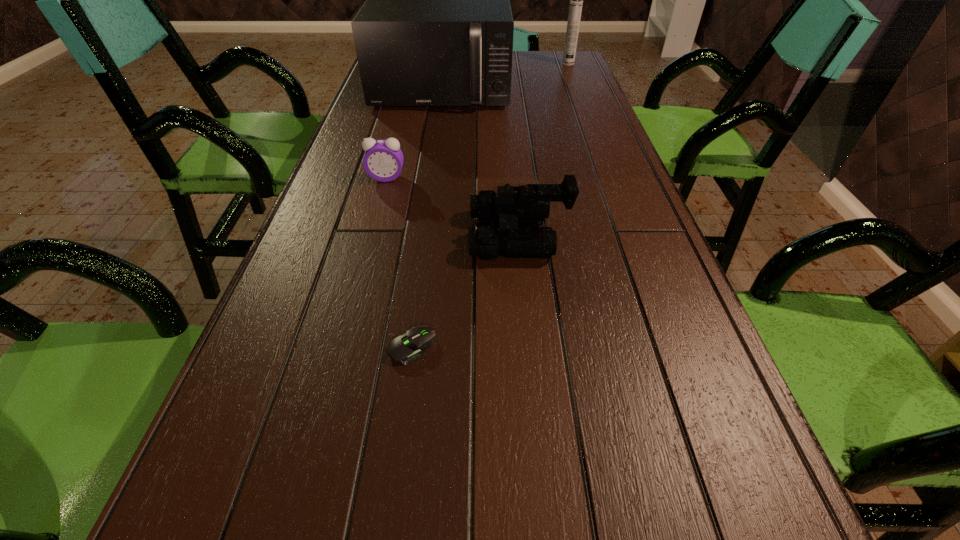
Where is `vacant region between the nearest object and the microwave oven`? vacant region between the nearest object and the microwave oven is located at coordinates (427, 218).

I want to click on vacant space that's between the aerosol can and the alarm clock, so click(x=477, y=121).

Where is `empty space that is in between the microwave oven and the nearest object`? This screenshot has height=540, width=960. empty space that is in between the microwave oven and the nearest object is located at coordinates (427, 218).

You are a GUI agent. You are given a task and a screenshot of the screen. Output one action in this format:
    pyautogui.click(x=<x>, y=<y>)
    Task: Click on the vacant space that is in between the third farthest object and the rightmost object
    The width and height of the screenshot is (960, 540).
    Given the screenshot: What is the action you would take?
    pyautogui.click(x=477, y=121)

Find the location of a particular element. This screenshot has height=540, width=960. free space between the third tallest object and the alarm clock is located at coordinates (453, 207).

The width and height of the screenshot is (960, 540). I want to click on the closest object to the aerosol can, so click(x=436, y=29).

Identify the location of object identified as the fourth closest to the binoculars. (576, 0).

I want to click on vacant region that satisfies the following two spatial constraints: 1. on the front-facing side of the microwave oven; 2. on the left side of the nearest object, so click(402, 347).